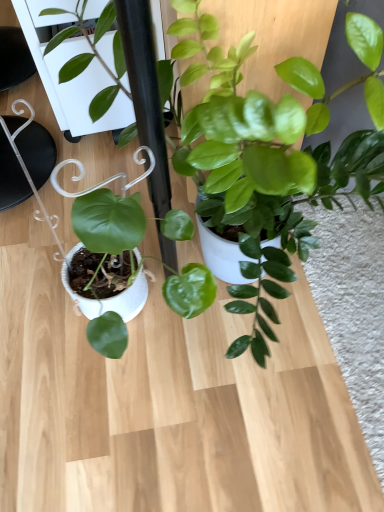
Describe the element at coordinates (274, 123) in the screenshot. The width and height of the screenshot is (384, 512). I see `green matte plant at center` at that location.

Identify the location of green matte plant at center. 274,123.

At what (x,y) coordinates should I click in order to perform the action: click on green matte plant at center. Please return your answer as a coordinate pair (x, y). Looking at the image, I should click on (274, 123).